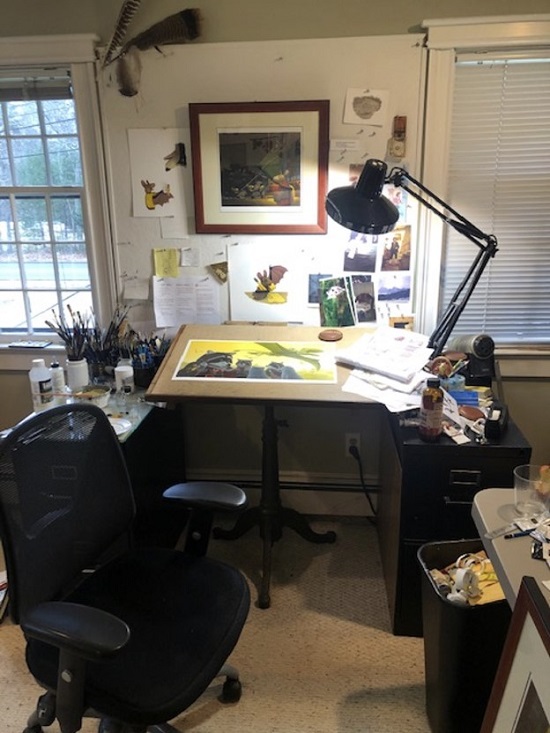
Find the location of `white corkboard`. white corkboard is located at coordinates (219, 56).